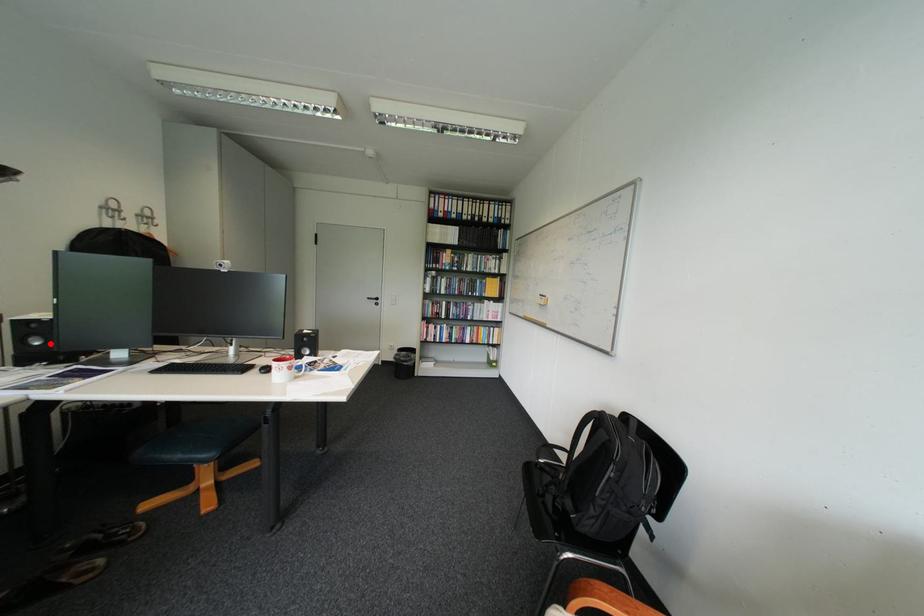
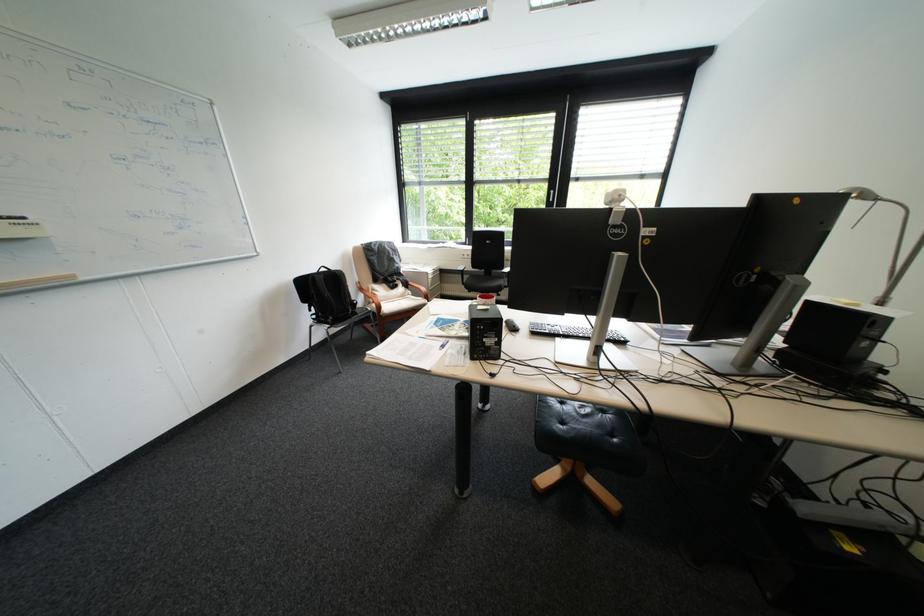
Question: I am providing you with two images of the same scene from different viewpoints. A red point is marked on the first image. At the location where the point appears in image 1, is it still visible in image 2?

Choices:
 (A) Yes
 (B) No

Answer: (B)